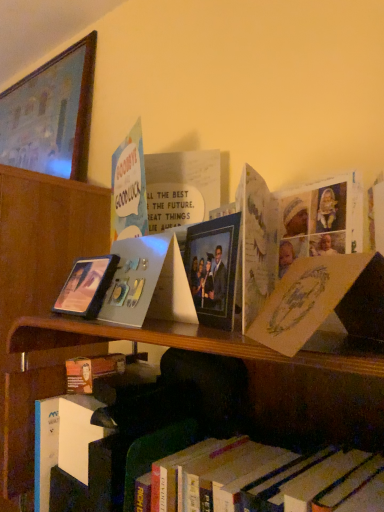
I want to click on free space above wooden picture frame at upper left, marked as the 1th picture frame in a top-to-bottom arrangement (from a real-world perspective), so click(x=34, y=70).